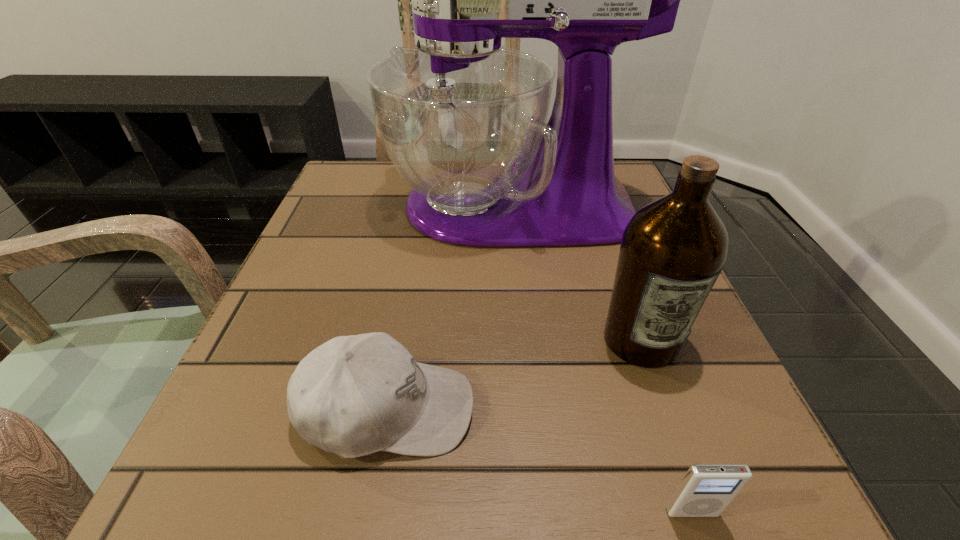
At what (x,y) coordinates should I click in order to perform the action: click on mixer. Please return your answer as a coordinate pair (x, y). Looking at the image, I should click on (463, 119).

Find the location of `the farthest object`. the farthest object is located at coordinates (463, 119).

Locate an element on the screen. the second tallest object is located at coordinates (673, 249).

You are a GUI agent. You are given a task and a screenshot of the screen. Output one action in this format:
    pyautogui.click(x=<x>, y=<y>)
    Task: Click on the baseball cap
    Image resolution: width=960 pixels, height=540 pixels.
    Given the screenshot: What is the action you would take?
    pyautogui.click(x=355, y=395)

You are a GUI agent. You are given a task and a screenshot of the screen. Output one action in this format:
    pyautogui.click(x=<x>, y=<y>)
    Task: Click on the iPod
    
    Given the screenshot: What is the action you would take?
    pyautogui.click(x=706, y=490)

Find the location of a particular element. Image resolution: width=960 pixels, height=540 pixels. the shortest object is located at coordinates (706, 490).

Locate an element on the screen. This screenshot has height=540, width=960. free space located at the bowl opening of the tallest object is located at coordinates (356, 207).

At what (x,y) coordinates should I click in order to perform the action: click on blank space located on the label of the olive oil. Please return your answer as a coordinate pair (x, y). This screenshot has height=540, width=960. Looking at the image, I should click on point(668,417).

Image resolution: width=960 pixels, height=540 pixels. What are the coordinates of `blank area located 0.210m on the front-facing side of the baseball cap` in the screenshot? It's located at (631, 410).

Identify the location of object that is at the far edge. (463, 119).